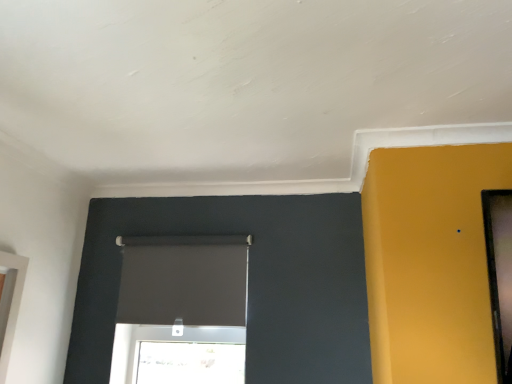
Question: Considering the positions of point (11, 258) and point (182, 241), is point (11, 258) closer or farther from the camera than point (182, 241)?

Choices:
 (A) farther
 (B) closer

Answer: (B)

Question: Based on their sizes in the image, would you say white glossy window at left, the 1th window viewed from the front, is bigger or smaller than matte black roller blind at center, the first window from the back?

Choices:
 (A) small
 (B) big

Answer: (A)

Question: From a real-world perspective, is white glossy window at left, which is the 1th window from left to right, positioned above or below matte black roller blind at center, the first window from the back?

Choices:
 (A) below
 (B) above

Answer: (A)

Question: Considering the relative positions of matte black roller blind at center, the second window in the left-to-right sequence, and white glossy window at left, the 1th window viewed from the front, in the image provided, is matte black roller blind at center, the second window in the left-to-right sequence, to the left or to the right of white glossy window at left, the 1th window viewed from the front,?

Choices:
 (A) right
 (B) left

Answer: (A)

Question: Considering the positions of matte black roller blind at center, the first window from the back, and white glossy window at left, which is the 1th window from left to right, in the image, is matte black roller blind at center, the first window from the back, bigger or smaller than white glossy window at left, which is the 1th window from left to right,?

Choices:
 (A) small
 (B) big

Answer: (B)

Question: Looking at their shapes, would you say matte black roller blind at center, the 2th window when ordered from front to back, is wider or thinner than white glossy window at left, which is the 2th window in right-to-left order?

Choices:
 (A) wide
 (B) thin

Answer: (B)

Question: Does point (241, 362) appear closer or farther from the camera than point (4, 380)?

Choices:
 (A) farther
 (B) closer

Answer: (A)